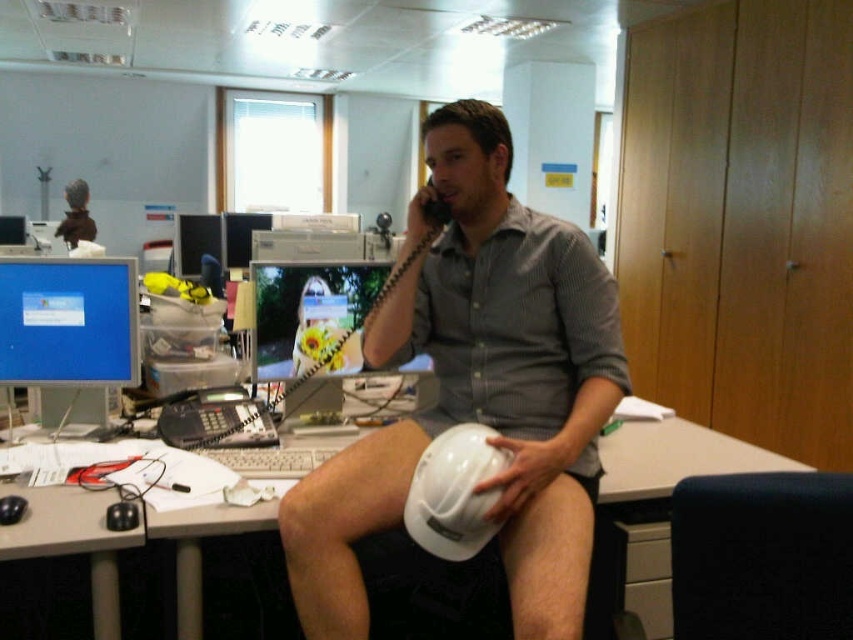
Consider the image. You are standing 5 feet away from the desk in the office scene. There is a point at coordinates point (x=474, y=536). Can you reach that point without moving closer than 4 feet to the desk?

The distance of point (x=474, y=536) from viewer is 4.38 feet. Since you are standing 5 feet away from the desk, you can reach the point as it is within your 4 feet proximity threshold.

You are an office assistant who needs to place a new document organizer on the desk. The organizer requires a space that is not under any hanging objects. Based on the scene, can you place it on the matte gray desk at center without being under the matte black monitor at upper left?

The matte gray desk at center is positioned under the matte black monitor at upper left, so placing the document organizer there would mean it is under the monitor. Therefore, you should choose another location on the desk that is not under the monitor.

You are organizing items on the desk and need to place a new item that requires the same width as the white hard hat at center. Can the matte black monitor at upper left accommodate this item in terms of width?

The white hard hat at center has a smaller width than the matte black monitor at upper left, so the matte black monitor at upper left can accommodate the item since it is wider than the white hard hat at center.